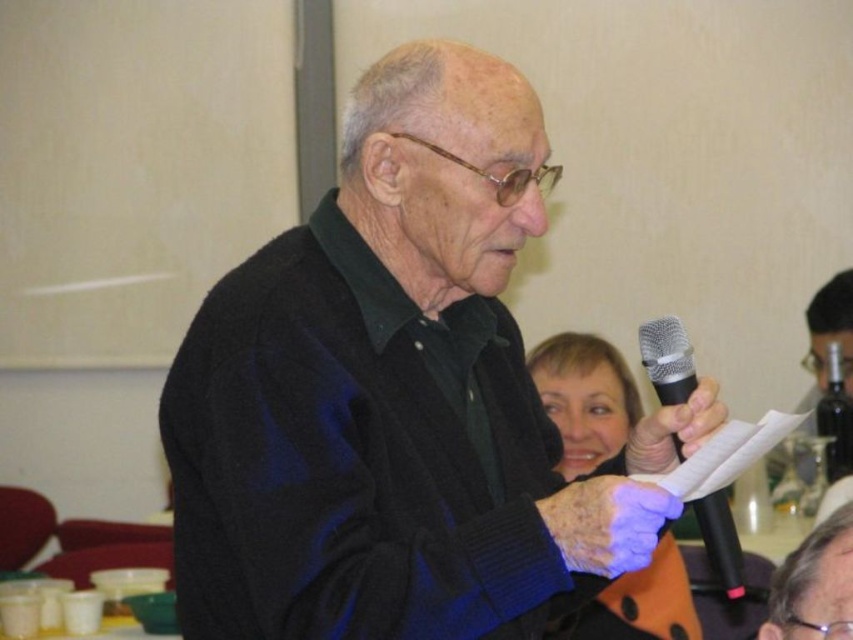
Question: Estimate the real-world distances between objects in this image. Which object is closer to the black matte microphone at center?

Choices:
 (A) purple leather glove at center
 (B) black wool sweater at center
 (C) matte black microphone at center
 (D) black metallic microphone at center

Answer: (D)

Question: Is purple leather glove at center further to the viewer compared to smooth gray hair at upper center?

Choices:
 (A) yes
 (B) no

Answer: (B)

Question: Which of the following is the closest to the observer?

Choices:
 (A) (630, 625)
 (B) (804, 586)
 (C) (631, 544)

Answer: (C)

Question: From the image, what is the correct spatial relationship of black wool sweater at center in relation to black matte microphone at center?

Choices:
 (A) left
 (B) right

Answer: (A)

Question: Which point is farther from the camera taking this photo?

Choices:
 (A) coord(643,509)
 (B) coord(715,403)
 (C) coord(807,609)
 (D) coord(408,499)

Answer: (C)

Question: Is purple leather glove at center above smooth gray hair at upper center?

Choices:
 (A) yes
 (B) no

Answer: (A)